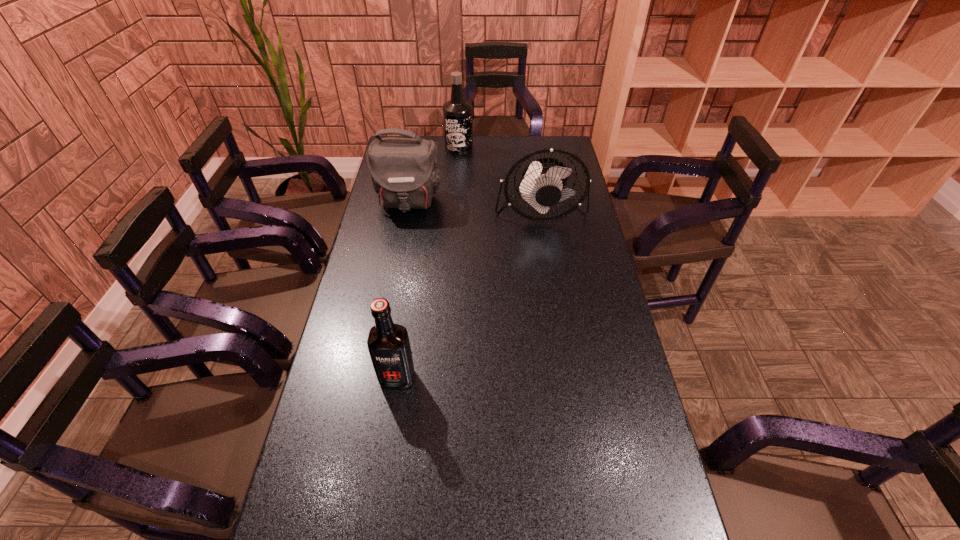
Find the location of a particular element. The image size is (960, 540). free space between the nearest object and the shoulder bag is located at coordinates (402, 289).

The image size is (960, 540). Find the location of `vacant space that is in between the shoulder bag and the left liquor`. vacant space that is in between the shoulder bag and the left liquor is located at coordinates (402, 289).

This screenshot has width=960, height=540. In order to click on the third closest object to the left liquor in this screenshot , I will do `click(457, 113)`.

Select which object is the second closest to the left liquor. Please provide its 2D coordinates. Your answer should be formatted as a tuple, i.e. [(x, y)], where the tuple contains the x and y coordinates of a point satisfying the conditions above.

[(404, 172)]